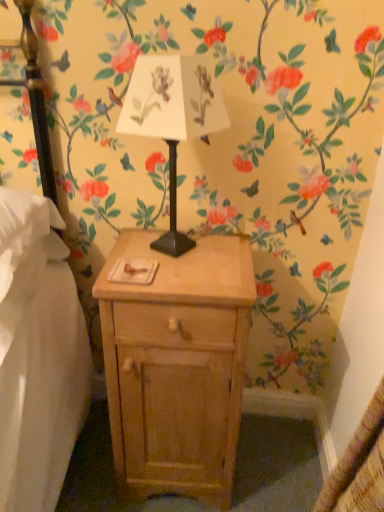
In order to click on vacant space underneath white paper lampshade at center (from a real-world perspective) in this screenshot , I will do `click(177, 253)`.